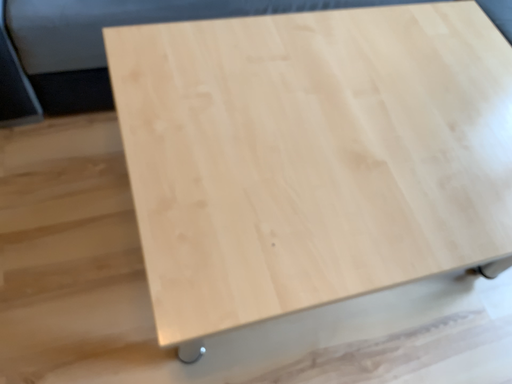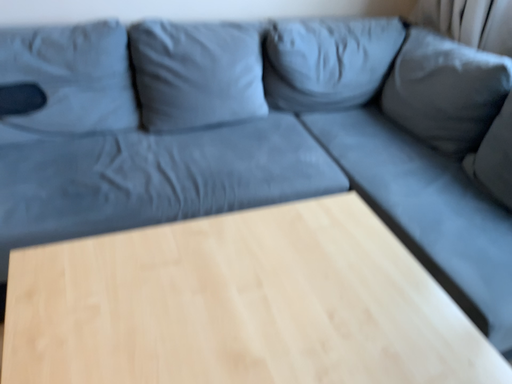
Question: Which way did the camera rotate in the video?

Choices:
 (A) rotated upward
 (B) rotated downward

Answer: (A)